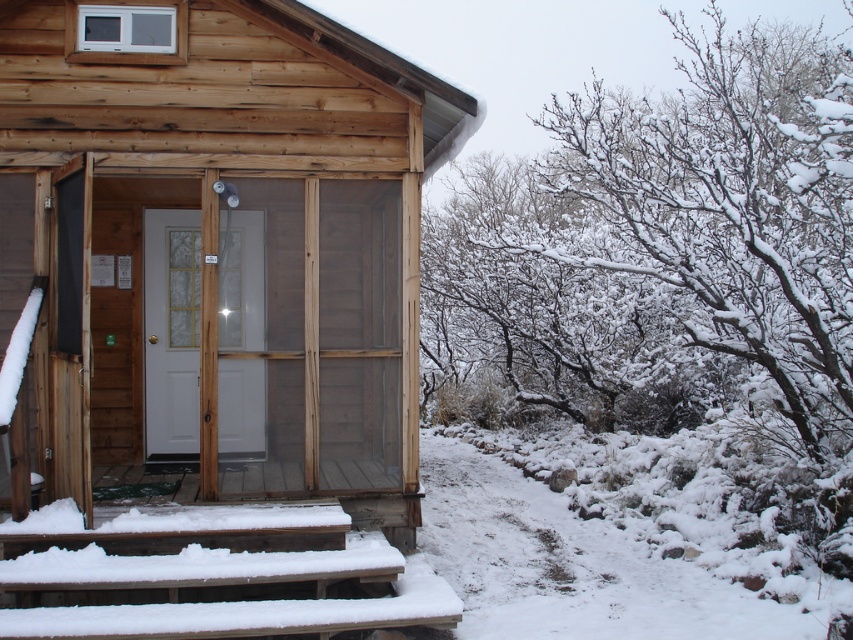
Question: Which object appears closest to the camera in this image?

Choices:
 (A) clear glass screen door at center
 (B) snow-covered branches at upper right
 (C) snow-covered wooden stairs at lower left

Answer: (C)

Question: Can you confirm if snow-covered branches at upper right is bigger than snow-covered wooden stairs at lower left?

Choices:
 (A) no
 (B) yes

Answer: (B)

Question: Among these points, which one is nearest to the camera?

Choices:
 (A) (822, 314)
 (B) (32, 596)
 (C) (146, 230)

Answer: (B)

Question: Can you confirm if snow-covered branches at upper right is smaller than snow-covered wooden stairs at lower left?

Choices:
 (A) no
 (B) yes

Answer: (A)

Question: Which point is closer to the camera?

Choices:
 (A) clear glass screen door at center
 (B) snow-covered branches at upper right

Answer: (B)

Question: Can you confirm if snow-covered wooden stairs at lower left is thinner than clear glass screen door at center?

Choices:
 (A) yes
 (B) no

Answer: (B)